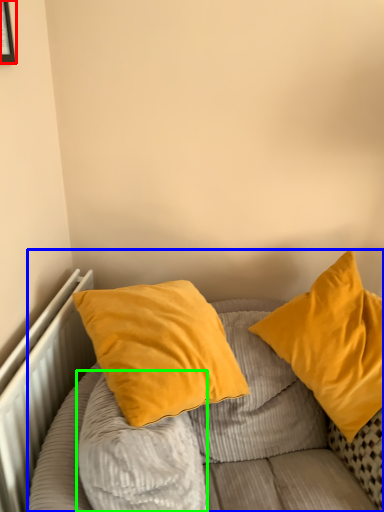
Question: Which object is the farthest from picture frame (highlighted by a red box)? Choose among these: bed (highlighted by a blue box) or pillow (highlighted by a green box).

Choices:
 (A) bed
 (B) pillow

Answer: (A)